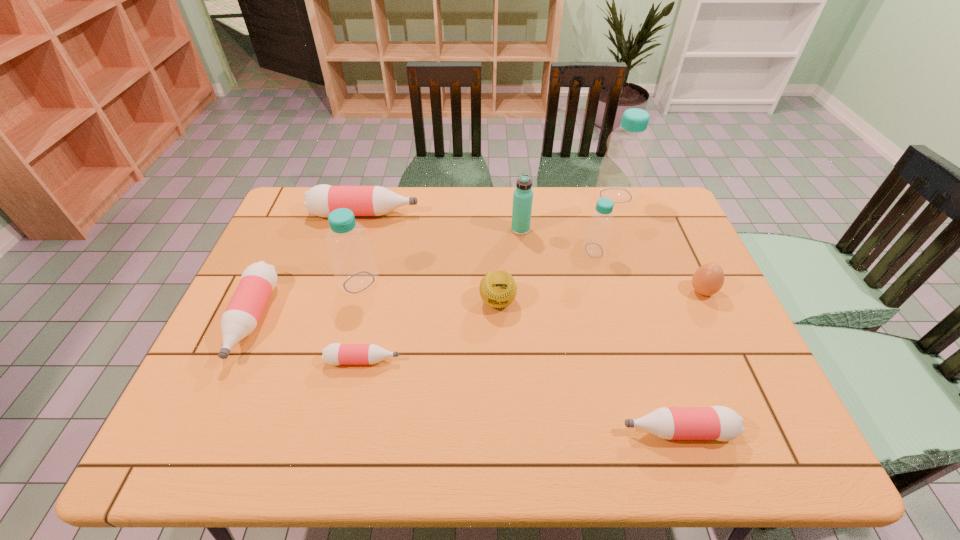
Locate an element on the screen. Image resolution: width=960 pixels, height=540 pixels. vacant area between the second blue bottle from left to right and the yellow softball is located at coordinates (546, 276).

This screenshot has width=960, height=540. Identify the location of vacant area that lies between the second blue bottle from left to right and the third shortest bottle. (423, 285).

At what (x,y) coordinates should I click in order to perform the action: click on vacant area between the fifth shortest bottle and the third shortest bottle. Please return your answer as a coordinate pair (x, y). This screenshot has height=540, width=960. Looking at the image, I should click on (423, 285).

Choose which object is the fourth nearest neighbor to the aqua thermos bottle. Please provide its 2D coordinates. Your answer should be formatted as a tuple, i.e. [(x, y)], where the tuple contains the x and y coordinates of a point satisfying the conditions above.

[(321, 200)]

Choose which object is the ninth nearest neighbor to the rightmost blue bottle. Please provide its 2D coordinates. Your answer should be formatted as a tuple, i.e. [(x, y)], where the tuple contains the x and y coordinates of a point satisfying the conditions above.

[(258, 280)]

Identify which bottle is located as the nearest to the brown boiled egg. Please provide its 2D coordinates. Your answer should be formatted as a tuple, i.e. [(x, y)], where the tuple contains the x and y coordinates of a point satisfying the conditions above.

[(595, 243)]

Locate an element on the screen. The height and width of the screenshot is (540, 960). bottle that is the nearest to the nearest blue bottle is located at coordinates (258, 280).

Locate an element on the screen. blue bottle that is the second closest to the shortest object is located at coordinates (595, 243).

Locate an element on the screen. The image size is (960, 540). blue bottle that stands as the second closest to the softball is located at coordinates (353, 263).

Locate an element on the screen. pink bottle identified as the second closest to the ninth tallest object is located at coordinates (321, 200).